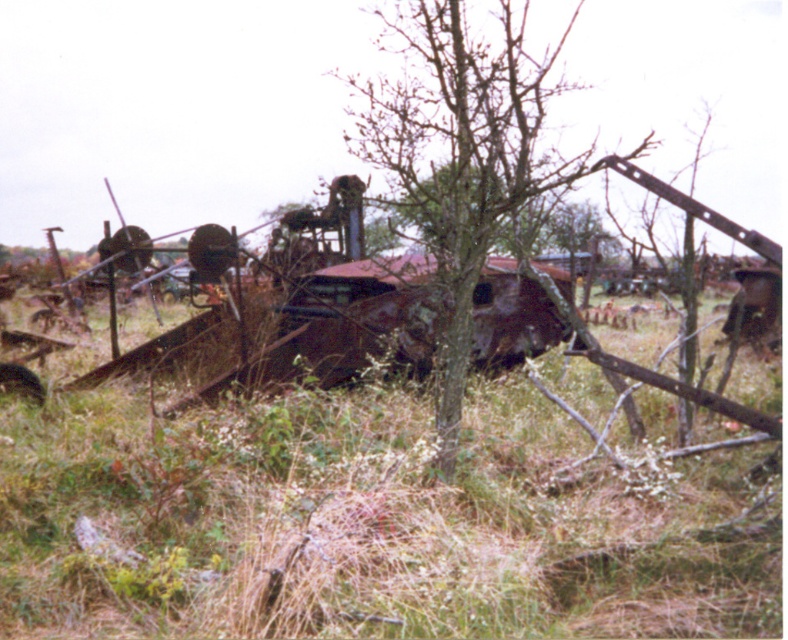
Consider the image. You are a painter who wants to capture the contrast between the natural and industrial elements in the scene. Which object is wider, the bare wood tree at center or the rusty metal train car at center?

→ The bare wood tree at center is wider than the rusty metal train car at center.

You are standing at the point marked by the coordinates point (543, 340) and want to move towards the point marked by point (173, 536). According to the scene description, which direction should you face to walk towards the correct destination?

To move from point (543, 340) to point (173, 536), you should face northeast because point (173, 536) is located northeast of point (543, 340).

You are a gardener trying to decide which area to mow first. The green grass at center and the bare wood tree at center are both in your sight. Which one has a narrower width?

The green grass at center has a narrower width than the bare wood tree at center.